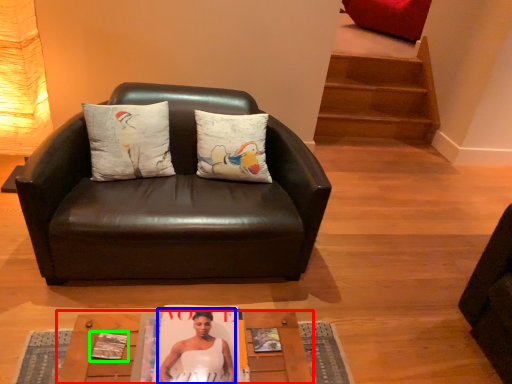
Question: Based on their relative distances, which object is farther from table (highlighted by a red box)? Choose from person (highlighted by a blue box) and magazine (highlighted by a green box).

Choices:
 (A) person
 (B) magazine

Answer: (B)